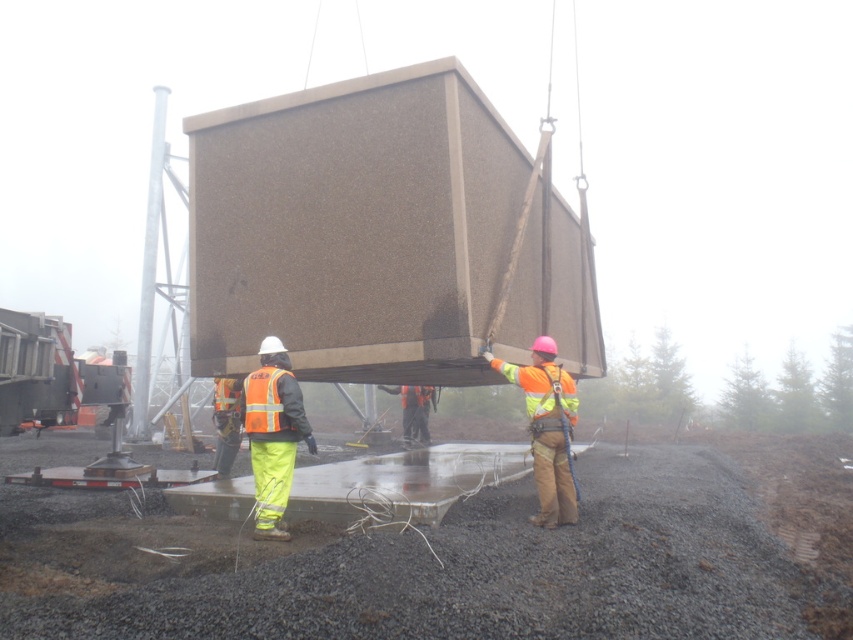
Question: Which point is farther to the camera?

Choices:
 (A) (532, 376)
 (B) (274, 460)
 (C) (196, 616)
 (D) (263, 432)

Answer: (A)

Question: Is black gravel at lower center further to the viewer compared to orange reflective safety vest at center?

Choices:
 (A) no
 (B) yes

Answer: (A)

Question: Among these points, which one is nearest to the camera?

Choices:
 (A) (567, 483)
 (B) (525, 381)

Answer: (B)

Question: Is hi-visibility reflective vest at center bigger than reflective yellow safety vest at center?

Choices:
 (A) no
 (B) yes

Answer: (B)

Question: Among these objects, which one is farthest from the camera?

Choices:
 (A) hi-visibility reflective jacket at center
 (B) black gravel at lower center

Answer: (A)

Question: Observing the image, what is the correct spatial positioning of reflective yellow safety vest at center in reference to orange reflective safety vest at center?

Choices:
 (A) right
 (B) left

Answer: (A)